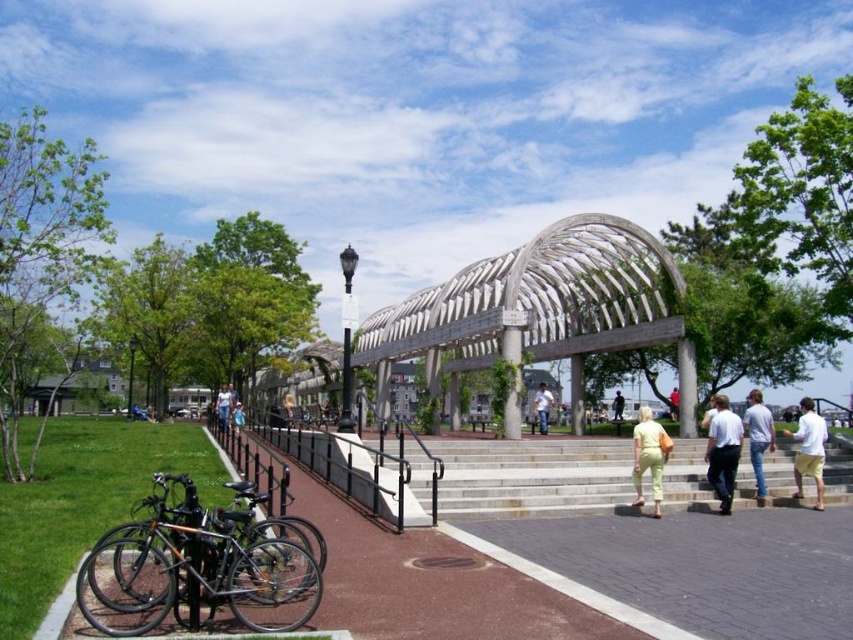
Can you confirm if light blue jeans at center is bigger than light yellow pants at center?

Yes.

Is light blue jeans at center taller than light yellow pants at center?

Incorrect, light blue jeans at center's height is not larger of light yellow pants at center's.

The height and width of the screenshot is (640, 853). What do you see at coordinates (223, 406) in the screenshot? I see `light blue jeans at center` at bounding box center [223, 406].

This screenshot has height=640, width=853. In order to click on light blue jeans at center in this screenshot , I will do `click(223, 406)`.

Is shiny black bicycle at lower left taller than white cotton shirt at center?

Correct, shiny black bicycle at lower left is much taller as white cotton shirt at center.

Describe the element at coordinates (196, 568) in the screenshot. I see `shiny black bicycle at lower left` at that location.

You are a GUI agent. You are given a task and a screenshot of the screen. Output one action in this format:
    pyautogui.click(x=<x>, y=<y>)
    Task: Click on the shiny black bicycle at lower left
    This screenshot has height=640, width=853.
    Given the screenshot: What is the action you would take?
    pyautogui.click(x=196, y=568)

Does light gray concrete stairs at center come in front of lime green jumpsuit at center?

Yes, light gray concrete stairs at center is closer to the viewer.

Who is positioned more to the left, light gray concrete stairs at center or lime green jumpsuit at center?

Positioned to the left is light gray concrete stairs at center.

Is point (421, 474) farther from camera compared to point (643, 428)?

No, it is not.

This screenshot has height=640, width=853. In order to click on light gray concrete stairs at center in this screenshot , I will do `click(532, 476)`.